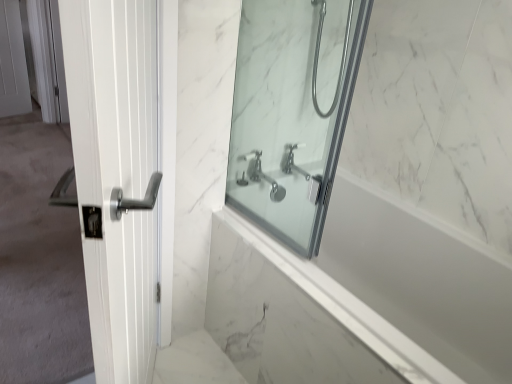
Question: From the image's perspective, is satin nickel showerhead at upper center located above clear glass shower door at center?

Choices:
 (A) no
 (B) yes

Answer: (B)

Question: Is satin nickel showerhead at upper center taller than clear glass shower door at center?

Choices:
 (A) yes
 (B) no

Answer: (B)

Question: Can you confirm if satin nickel showerhead at upper center is shorter than clear glass shower door at center?

Choices:
 (A) no
 (B) yes

Answer: (B)

Question: Is satin nickel showerhead at upper center behind clear glass shower door at center?

Choices:
 (A) yes
 (B) no

Answer: (A)

Question: From the image's perspective, does satin nickel showerhead at upper center appear lower than clear glass shower door at center?

Choices:
 (A) yes
 (B) no

Answer: (B)

Question: Is satin nickel showerhead at upper center positioned with its back to clear glass shower door at center?

Choices:
 (A) no
 (B) yes

Answer: (A)

Question: Can you confirm if white glossy door handle at left is bigger than white glossy door handle at left?

Choices:
 (A) no
 (B) yes

Answer: (A)

Question: From the image's perspective, does white glossy door handle at left appear lower than white glossy door handle at left?

Choices:
 (A) no
 (B) yes

Answer: (A)

Question: Is white glossy door handle at left taller than white glossy door handle at left?

Choices:
 (A) no
 (B) yes

Answer: (A)

Question: Is white glossy door handle at left further to the viewer compared to white glossy door handle at left?

Choices:
 (A) no
 (B) yes

Answer: (B)

Question: Is white glossy door handle at left located within white glossy door handle at left?

Choices:
 (A) no
 (B) yes

Answer: (A)

Question: Considering the relative sizes of white glossy door handle at left and white glossy door handle at left in the image provided, is white glossy door handle at left smaller than white glossy door handle at left?

Choices:
 (A) no
 (B) yes

Answer: (B)

Question: Is satin nickel showerhead at upper center to the left of white glossy door handle at left from the viewer's perspective?

Choices:
 (A) yes
 (B) no

Answer: (B)